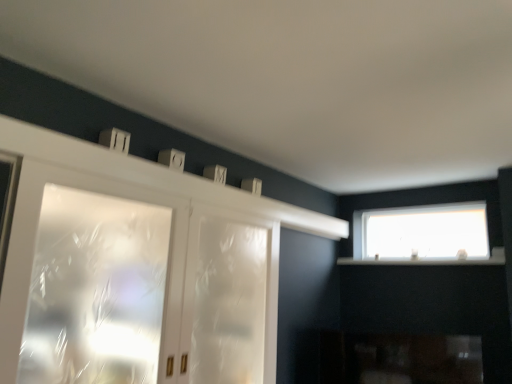
Question: Considering the relative positions of transparent plastic screen door at center and frosted glass cabinet at left, acting as the second window starting from the back, in the image provided, is transparent plastic screen door at center to the right of frosted glass cabinet at left, acting as the second window starting from the back, from the viewer's perspective?

Choices:
 (A) no
 (B) yes

Answer: (B)

Question: Is the depth of transparent plastic screen door at center greater than that of frosted glass cabinet at left, the 2th window positioned from the right?

Choices:
 (A) no
 (B) yes

Answer: (B)

Question: Does transparent plastic screen door at center have a larger size compared to frosted glass cabinet at left, the 2th window positioned from the right?

Choices:
 (A) yes
 (B) no

Answer: (A)

Question: Can you confirm if transparent plastic screen door at center is thinner than frosted glass cabinet at left, acting as the second window starting from the back?

Choices:
 (A) no
 (B) yes

Answer: (B)

Question: Is transparent plastic screen door at center positioned in front of frosted glass cabinet at left, acting as the second window starting from the back?

Choices:
 (A) no
 (B) yes

Answer: (A)

Question: In the image, is white matte mantle at upper center on the left side or the right side of frosted glass cabinet at left, which appears as the 1th window when viewed from the left?

Choices:
 (A) left
 (B) right

Answer: (B)

Question: Based on their sizes in the image, would you say white matte mantle at upper center is bigger or smaller than frosted glass cabinet at left, which appears as the 1th window when viewed from the left?

Choices:
 (A) small
 (B) big

Answer: (A)

Question: From the image's perspective, relative to frosted glass cabinet at left, which appears as the first window when viewed from the front, is white matte mantle at upper center above or below?

Choices:
 (A) below
 (B) above

Answer: (B)

Question: Is white matte mantle at upper center taller or shorter than frosted glass cabinet at left, which appears as the 1th window when viewed from the left?

Choices:
 (A) short
 (B) tall

Answer: (A)

Question: Is frosted glass cabinet at left, the 2th window positioned from the right, situated inside transparent plastic screen door at center or outside?

Choices:
 (A) outside
 (B) inside

Answer: (A)

Question: Considering the positions of frosted glass cabinet at left, acting as the second window starting from the back, and transparent plastic screen door at center in the image, is frosted glass cabinet at left, acting as the second window starting from the back, wider or thinner than transparent plastic screen door at center?

Choices:
 (A) wide
 (B) thin

Answer: (A)

Question: Visually, is frosted glass cabinet at left, acting as the second window starting from the back, positioned to the left or to the right of transparent plastic screen door at center?

Choices:
 (A) left
 (B) right

Answer: (A)

Question: From the image's perspective, is frosted glass cabinet at left, which appears as the 1th window when viewed from the left, located above or below transparent plastic screen door at center?

Choices:
 (A) above
 (B) below

Answer: (A)

Question: In the image, is frosted glass cabinet at left, which appears as the 1th window when viewed from the left, on the left side or the right side of white matte mantle at upper center?

Choices:
 (A) left
 (B) right

Answer: (A)

Question: Considering the positions of frosted glass cabinet at left, the 2th window positioned from the right, and white matte mantle at upper center in the image, is frosted glass cabinet at left, the 2th window positioned from the right, wider or thinner than white matte mantle at upper center?

Choices:
 (A) wide
 (B) thin

Answer: (B)